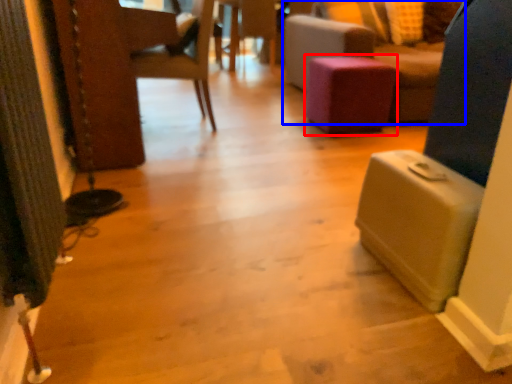
Question: Which of the following is the farthest to the observer, stool (highlighted by a red box) or furniture (highlighted by a blue box)?

Choices:
 (A) stool
 (B) furniture

Answer: (A)